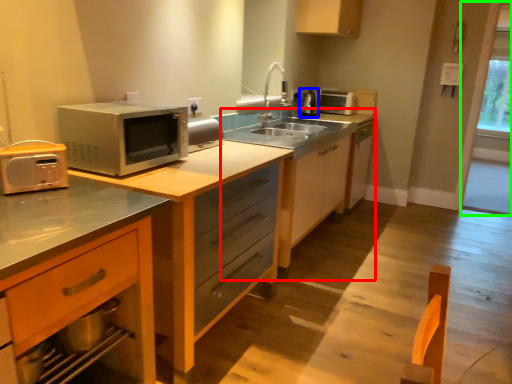
Question: Which object is positioned closest to dresser (highlighted by a red box)? Select from appliance (highlighted by a blue box) and window screen (highlighted by a green box).

Choices:
 (A) appliance
 (B) window screen

Answer: (A)